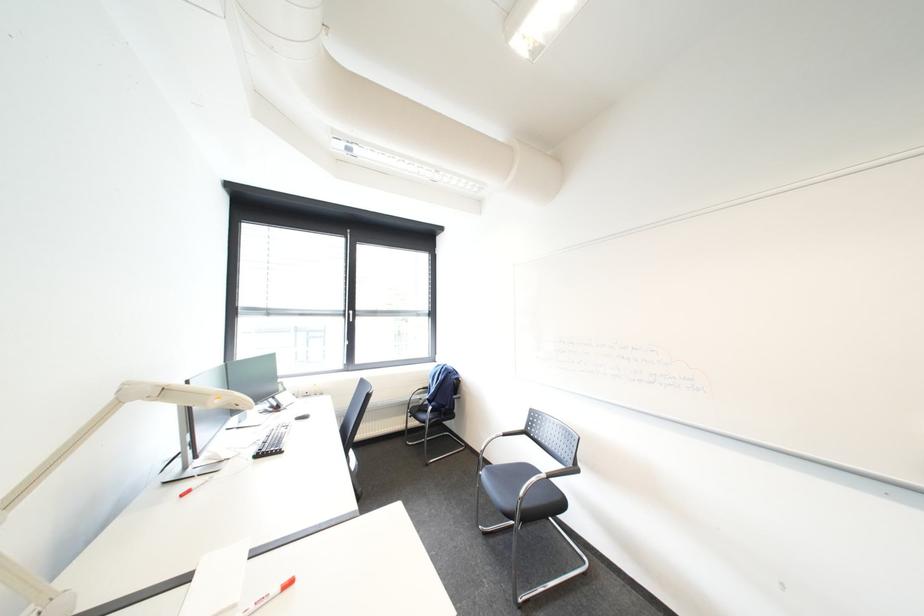
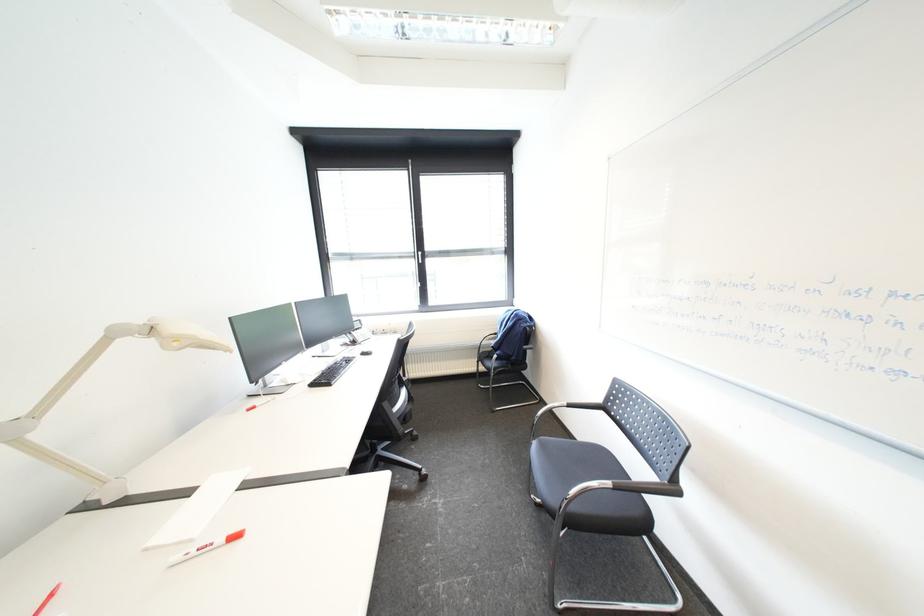
The images are taken continuously from a first-person perspective. In which direction are you moving?

The cameraman moved toward right, forward.